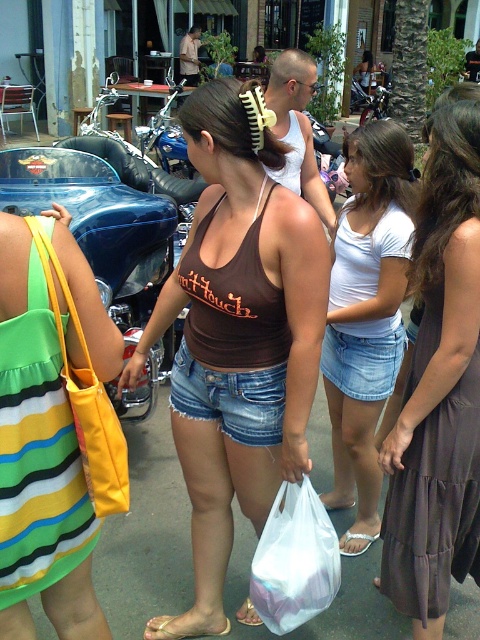
You are a photographer trying to capture the brown cotton dress at right and the yellow plastic comb at center in a single frame. Based on their positions, which object will appear closer to the bottom of the photo?

The brown cotton dress at right is positioned under the yellow plastic comb at center, so it will appear closer to the bottom of the photo.

You are standing in the urban scene and want to take a photo of the denim shorts at center and the white glittery sandal at lower center. Which object should you focus on first to ensure both are in the frame?

Since the denim shorts at center is closer to the viewer than the white glittery sandal at lower center, you should focus on the denim shorts at center first to ensure both are in the frame.